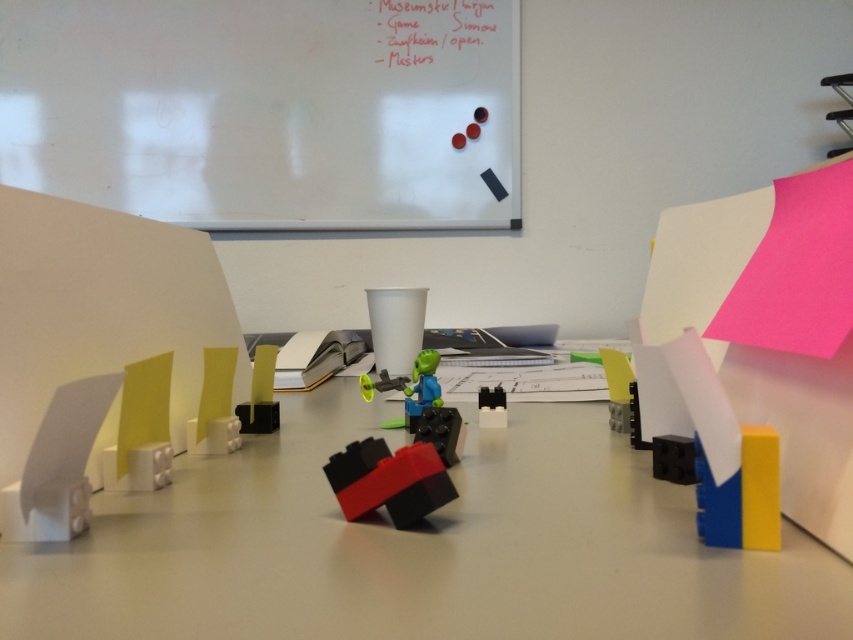
You are organizing the items on the table and need to place the white paper at upper center and the black plastic toy at center in a specific order. Which object should be placed to the left of the other?

The white paper at upper center should be placed to the right of the black plastic toy at center because the white paper at upper center is positioned on the right side of black plastic toy at center.

You are organizing items on the table and need to place a new item between the matte plastic table at center and the black plastic blocks at center. Based on their positions, where should you place the new item?

The matte plastic table at center is to the left of the black plastic blocks at center, so you should place the new item between them on the right side of the matte plastic table at center and the left side of the black plastic blocks at center.